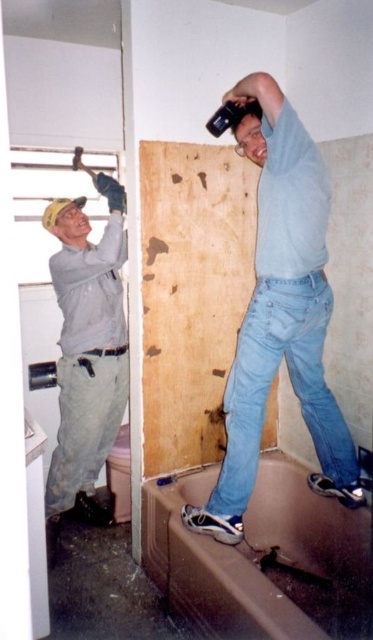
Describe the element at coordinates (280, 314) in the screenshot. The width and height of the screenshot is (373, 640). I see `light blue denim jeans at upper right` at that location.

Is light blue denim jeans at upper right taller than matte gray shirt at upper left?

Incorrect, light blue denim jeans at upper right's height is not larger of matte gray shirt at upper left's.

Is point (326, 172) positioned in front of point (123, 310)?

Yes, point (326, 172) is in front of point (123, 310).

Where is `light blue denim jeans at upper right`? light blue denim jeans at upper right is located at coordinates (280, 314).